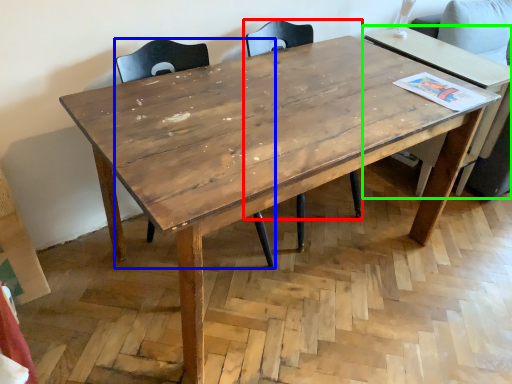
Question: Which is farther away from chair (highlighted by a red box)? chair (highlighted by a blue box) or table (highlighted by a green box)?

Choices:
 (A) chair
 (B) table

Answer: (B)